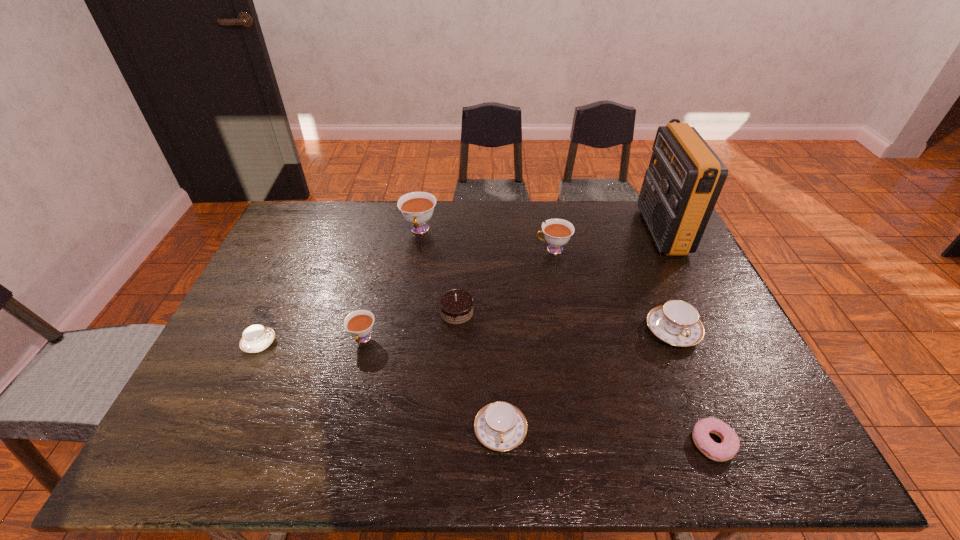
Where is `vacant space at the right edge`? The image size is (960, 540). vacant space at the right edge is located at coordinates (677, 266).

I want to click on vacant space at the far left corner of the desktop, so click(311, 230).

At what (x,y) coordinates should I click in order to perform the action: click on vacant space that's between the chocolate chocolate cake and the second tallest object. Please return your answer as a coordinate pair (x, y). Looking at the image, I should click on (438, 271).

Where is `vacant area that lies between the chocolate chocolate cake and the tallest object`? vacant area that lies between the chocolate chocolate cake and the tallest object is located at coordinates (559, 271).

Image resolution: width=960 pixels, height=540 pixels. What are the coordinates of `free space between the pink doughnut and the leftmost teacup` in the screenshot? It's located at (486, 393).

Locate an element on the screen. The height and width of the screenshot is (540, 960). unoccupied position between the shortest teacup and the fifth object from left to right is located at coordinates (380, 387).

At what (x,y) coordinates should I click in order to perform the action: click on unoccupied position between the doughnut and the rightmost white teacup. Please return your answer as a coordinate pair (x, y). Looking at the image, I should click on (633, 346).

Identify the location of empty space between the nearest teacup and the chocolate cake. Image resolution: width=960 pixels, height=540 pixels. (478, 371).

This screenshot has width=960, height=540. Find the location of `unoccupied position between the leftmost object and the second smallest white teacup`. unoccupied position between the leftmost object and the second smallest white teacup is located at coordinates (406, 296).

You are a GUI agent. You are given a task and a screenshot of the screen. Output one action in this format:
    pyautogui.click(x=<x>, y=<y>)
    Task: Click on the vacant area between the tallest object and the rightmost blue teacup
    The height and width of the screenshot is (540, 960).
    Given the screenshot: What is the action you would take?
    pyautogui.click(x=667, y=281)